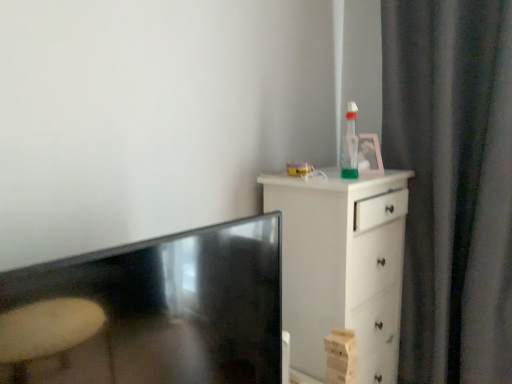
In the scene shown: What is the approximate height of matte black tv at lower left?

It is 22.62 inches.

This screenshot has height=384, width=512. Describe the element at coordinates (452, 184) in the screenshot. I see `dark gray fabric curtain at right` at that location.

Where is `white wood chest of drawers at right`? The height and width of the screenshot is (384, 512). white wood chest of drawers at right is located at coordinates (342, 265).

In the scene shown: Could you tell me if white wood chest of drawers at right is turned towards translucent green bottle at upper right?

No, white wood chest of drawers at right is not oriented towards translucent green bottle at upper right.

Is white wood chest of drawers at right surrounding translucent green bottle at upper right?

No.

Based on the photo, is white wood chest of drawers at right with translucent green bottle at upper right?

There is a gap between white wood chest of drawers at right and translucent green bottle at upper right.

From a real-world perspective, which is physically below, white wood chest of drawers at right or translucent green bottle at upper right?

white wood chest of drawers at right is physically lower.

Does dark gray fabric curtain at right have a lesser width compared to matte black tv at lower left?

Correct, the width of dark gray fabric curtain at right is less than that of matte black tv at lower left.

Is matte black tv at lower left surrounded by dark gray fabric curtain at right?

No, dark gray fabric curtain at right does not contain matte black tv at lower left.

At what (x,y) coordinates should I click in order to perform the action: click on curtain above the matte black tv at lower left (from the image's perspective). Please return your answer as a coordinate pair (x, y). The image size is (512, 384). Looking at the image, I should click on (452, 184).

In terms of size, does dark gray fabric curtain at right appear bigger or smaller than matte black tv at lower left?

Clearly, dark gray fabric curtain at right is larger in size than matte black tv at lower left.

Visually, is dark gray fabric curtain at right positioned to the left or to the right of translucent green bottle at upper right?

dark gray fabric curtain at right is to the right of translucent green bottle at upper right.

Looking at this image, which is in front, dark gray fabric curtain at right or translucent green bottle at upper right?

Positioned in front is dark gray fabric curtain at right.

You are a GUI agent. You are given a task and a screenshot of the screen. Output one action in this format:
    pyautogui.click(x=<x>, y=<y>)
    Task: Click on the curtain that is below the translucent green bottle at upper right (from the image's perspective)
    The width and height of the screenshot is (512, 384).
    Given the screenshot: What is the action you would take?
    pyautogui.click(x=452, y=184)

How many degrees apart are the facing directions of dark gray fabric curtain at right and translucent green bottle at upper right?

The angular difference between dark gray fabric curtain at right and translucent green bottle at upper right is 96.9 degrees.

Is matte black tv at lower left directly adjacent to dark gray fabric curtain at right?

There is a gap between matte black tv at lower left and dark gray fabric curtain at right.

Is matte black tv at lower left taller or shorter than dark gray fabric curtain at right?

In the image, matte black tv at lower left appears to be shorter than dark gray fabric curtain at right.

From a real-world perspective, is matte black tv at lower left physically above dark gray fabric curtain at right?

No, from a real-world perspective, matte black tv at lower left is not over dark gray fabric curtain at right

Do you think matte black tv at lower left is within dark gray fabric curtain at right, or outside of it?

matte black tv at lower left is spatially situated outside dark gray fabric curtain at right.

Does point (339, 218) come closer to viewer compared to point (83, 321)?

No.

Is white wood chest of drawers at right at the right side of matte black tv at lower left?

Yes, white wood chest of drawers at right is to the right of matte black tv at lower left.

From the image's perspective, is white wood chest of drawers at right on top of matte black tv at lower left?

No, from the image's perspective, white wood chest of drawers at right is not over matte black tv at lower left.

Could you tell me if white wood chest of drawers at right is turned towards dark gray fabric curtain at right?

Yes, white wood chest of drawers at right is oriented towards dark gray fabric curtain at right.

Considering the relative sizes of white wood chest of drawers at right and dark gray fabric curtain at right in the image provided, is white wood chest of drawers at right bigger than dark gray fabric curtain at right?

Correct, white wood chest of drawers at right is larger in size than dark gray fabric curtain at right.

Is dark gray fabric curtain at right a part of white wood chest of drawers at right?

No, dark gray fabric curtain at right is located outside of white wood chest of drawers at right.

From their relative heights in the image, would you say white wood chest of drawers at right is taller or shorter than dark gray fabric curtain at right?

In the image, white wood chest of drawers at right appears to be shorter than dark gray fabric curtain at right.

Between point (222, 340) and point (351, 161), which one is positioned behind?

The point (351, 161) is farther.

In the scene shown: Is matte black tv at lower left far from translucent green bottle at upper right?

matte black tv at lower left is actually quite close to translucent green bottle at upper right.

Which of these two, matte black tv at lower left or translucent green bottle at upper right, is wider?

matte black tv at lower left is wider.

Find the location of a particular element. bottle lying behind the white wood chest of drawers at right is located at coordinates tap(350, 145).

Locate an element on the screen. The height and width of the screenshot is (384, 512). table below the dark gray fabric curtain at right (from a real-world perspective) is located at coordinates (150, 311).

Looking at the image, which one is located further to dark gray fabric curtain at right, matte black tv at lower left or translucent green bottle at upper right?

matte black tv at lower left is positioned further to the anchor dark gray fabric curtain at right.

When comparing their distances from white wood chest of drawers at right, does matte black tv at lower left or translucent green bottle at upper right seem closer?

translucent green bottle at upper right is positioned closer to the anchor white wood chest of drawers at right.

Based on their spatial positions, is white wood chest of drawers at right or dark gray fabric curtain at right closer to matte black tv at lower left?

Based on the image, white wood chest of drawers at right appears to be nearer to matte black tv at lower left.

Estimate the real-world distances between objects in this image. Which object is further from matte black tv at lower left, dark gray fabric curtain at right or translucent green bottle at upper right?

dark gray fabric curtain at right is positioned further to the anchor matte black tv at lower left.

Considering their positions, is translucent green bottle at upper right positioned further to dark gray fabric curtain at right than white wood chest of drawers at right?

translucent green bottle at upper right lies further to dark gray fabric curtain at right than the other object.

Estimate the real-world distances between objects in this image. Which object is closer to translucent green bottle at upper right, dark gray fabric curtain at right or matte black tv at lower left?

Based on the image, dark gray fabric curtain at right appears to be nearer to translucent green bottle at upper right.

Considering their positions, is dark gray fabric curtain at right positioned further to white wood chest of drawers at right than translucent green bottle at upper right?

Among the two, translucent green bottle at upper right is located further to white wood chest of drawers at right.

When comparing their distances from matte black tv at lower left, does white wood chest of drawers at right or translucent green bottle at upper right seem closer?

white wood chest of drawers at right lies closer to matte black tv at lower left than the other object.

This screenshot has height=384, width=512. What are the coordinates of `chest of drawers between matte black tv at lower left and translucent green bottle at upper right along the z-axis` in the screenshot? It's located at [342, 265].

You are a GUI agent. You are given a task and a screenshot of the screen. Output one action in this format:
    pyautogui.click(x=<x>, y=<y>)
    Task: Click on the bottle between matte black tv at lower left and dark gray fabric curtain at right
    Image resolution: width=512 pixels, height=384 pixels.
    Given the screenshot: What is the action you would take?
    pyautogui.click(x=350, y=145)

Image resolution: width=512 pixels, height=384 pixels. Identify the location of the chest of drawers located between matte black tv at lower left and dark gray fabric curtain at right in the left-right direction. (342, 265).

Locate an element on the screen. This screenshot has height=384, width=512. curtain between translucent green bottle at upper right and white wood chest of drawers at right from top to bottom is located at coordinates (452, 184).